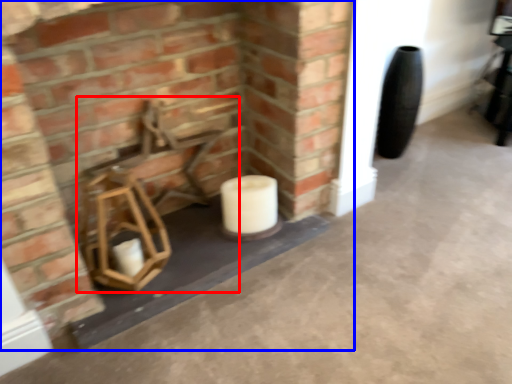
Question: Which object appears closest to the camera in this image, chair (highlighted by a red box) or fireplace (highlighted by a blue box)?

Choices:
 (A) chair
 (B) fireplace

Answer: (B)